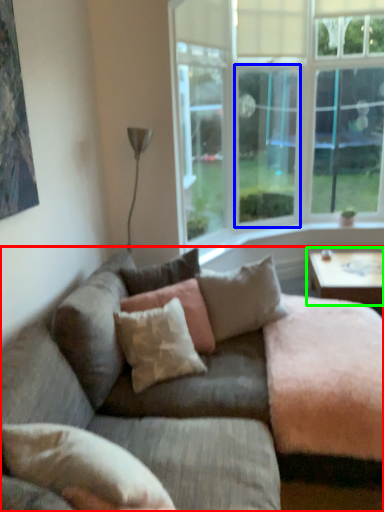
Question: Considering the real-world distances, which object is closest to studio couch (highlighted by a red box)? window screen (highlighted by a blue box) or coffee table (highlighted by a green box).

Choices:
 (A) window screen
 (B) coffee table

Answer: (B)